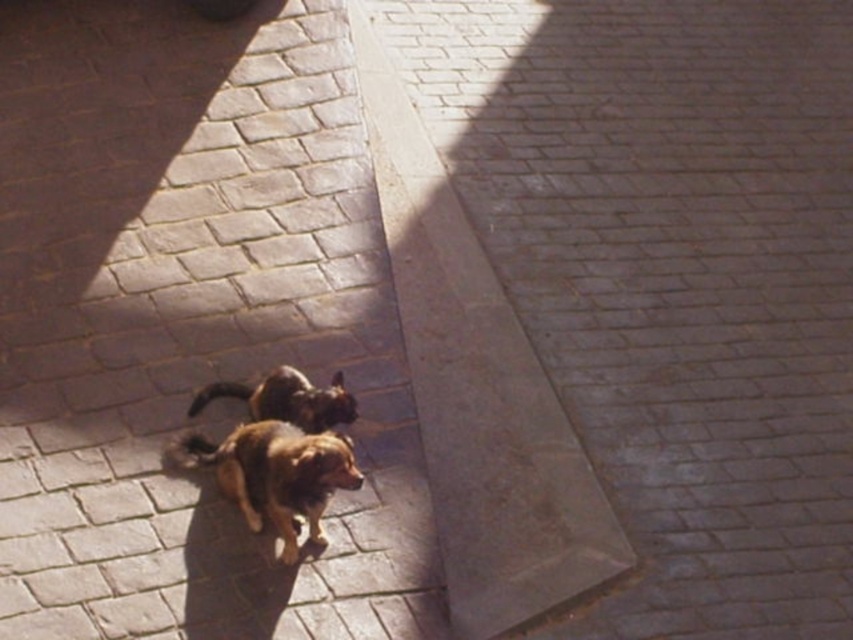
Question: Estimate the real-world distances between objects in this image. Which object is farther from the brown fur dog at center?

Choices:
 (A) gray brick pavement at lower left
 (B) brown furry dog at center

Answer: (A)

Question: Is the position of brick pavement at center less distant than that of brown furry dog at center?

Choices:
 (A) yes
 (B) no

Answer: (A)

Question: Does brick pavement at center lie behind gray brick pavement at lower left?

Choices:
 (A) no
 (B) yes

Answer: (A)

Question: Is brick pavement at center wider than gray brick pavement at lower left?

Choices:
 (A) yes
 (B) no

Answer: (B)

Question: Which point is closer to the camera?

Choices:
 (A) brick pavement at center
 (B) brown fur dog at center
 (C) brown furry dog at center
 (D) gray brick pavement at lower left

Answer: (B)

Question: Estimate the real-world distances between objects in this image. Which object is farther from the brown fur dog at center?

Choices:
 (A) brown furry dog at center
 (B) gray brick pavement at lower left
 (C) brick pavement at center

Answer: (B)